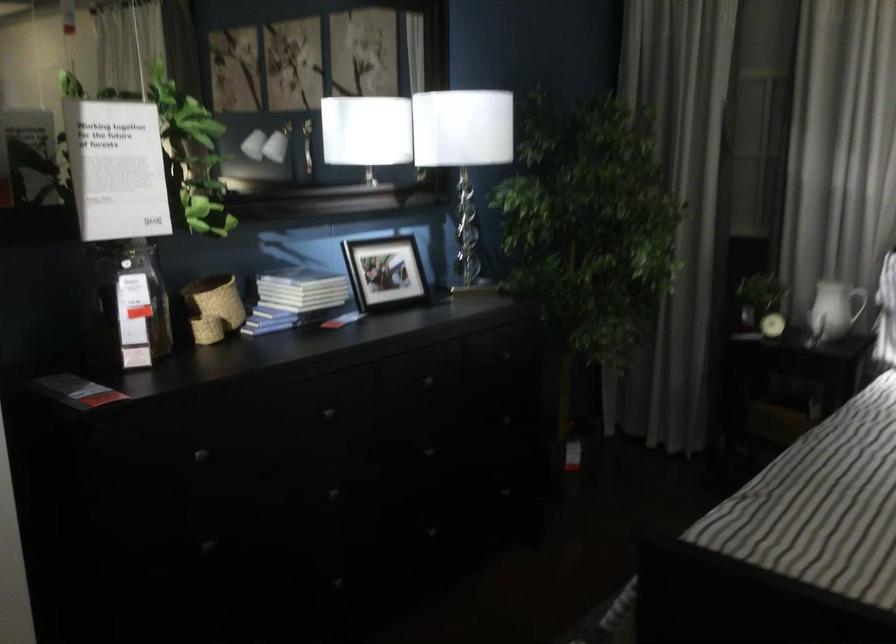
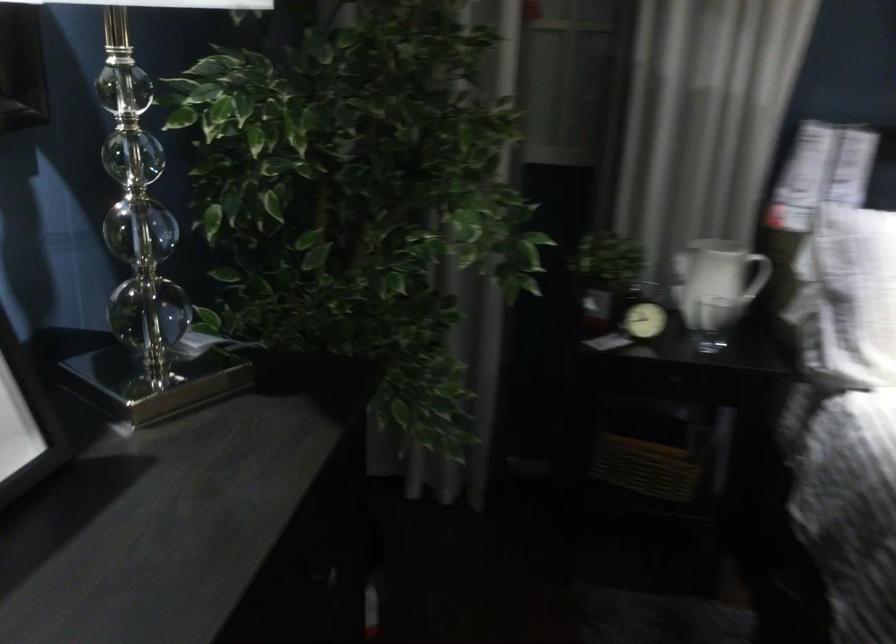
The point at (x=778, y=313) is marked in the first image. Where is the corresponding point in the second image?

(643, 321)